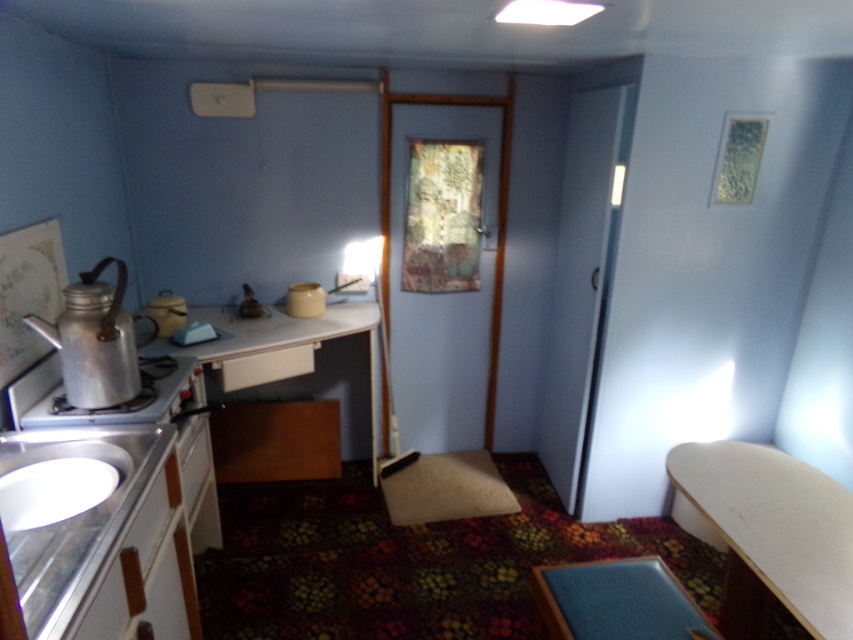
Question: Does white matte table at right have a smaller size compared to metallic teapot at left?

Choices:
 (A) yes
 (B) no

Answer: (A)

Question: Which object is closer to the camera taking this photo?

Choices:
 (A) white matte table at right
 (B) silver metallic stove at lower left
 (C) metallic teapot at left

Answer: (A)

Question: Is wooden table at center above silver metallic stove at lower left?

Choices:
 (A) yes
 (B) no

Answer: (A)

Question: Does white matte table at right lie behind white glossy sink at lower left?

Choices:
 (A) no
 (B) yes

Answer: (B)

Question: Which of these objects is positioned closest to the white matte table at right?

Choices:
 (A) silver metallic stove at lower left
 (B) wooden table at center

Answer: (B)

Question: Which of the following is the farthest from the observer?

Choices:
 (A) (16, 499)
 (B) (61, 362)
 (C) (225, 323)

Answer: (C)